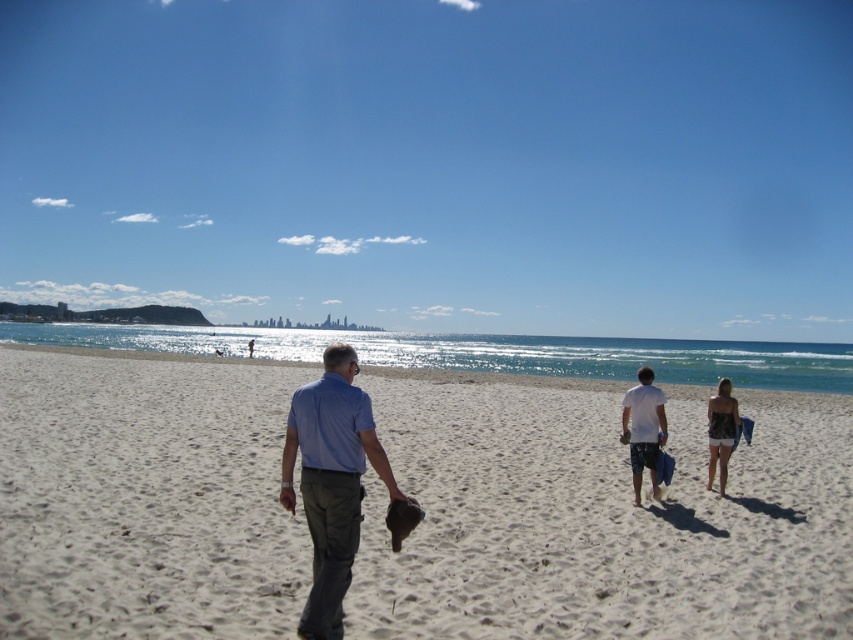
Question: Which object is closer to the camera taking this photo?

Choices:
 (A) blue sky at upper center
 (B) white sandy beach at center

Answer: (B)

Question: Can you confirm if blue sky at upper center is positioned to the left of white sandy beach at center?

Choices:
 (A) yes
 (B) no

Answer: (A)

Question: Which of these objects is positioned closest to the white sandy beach at center?

Choices:
 (A) blue cotton shirt at center
 (B) white cotton t-shirt at center-right
 (C) patterned fabric top at center right

Answer: (B)

Question: Does blue sky at upper center have a lesser width compared to patterned fabric top at center right?

Choices:
 (A) no
 (B) yes

Answer: (A)

Question: Does blue sky at upper center appear over patterned fabric top at center right?

Choices:
 (A) no
 (B) yes

Answer: (B)

Question: Which point is closer to the camera?

Choices:
 (A) coord(308,42)
 (B) coord(654,448)
 (C) coord(726,410)
 (D) coord(325,570)

Answer: (D)